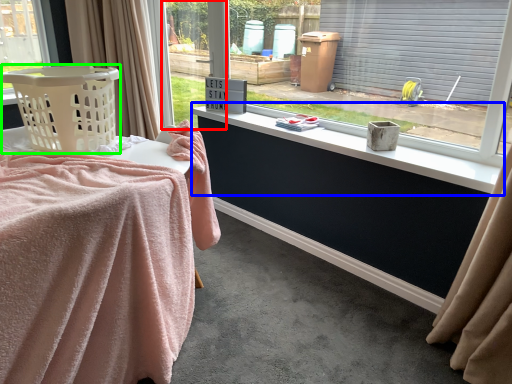
Question: Which object is the farthest from window frame (highlighted by a red box)? Choose among these: window sill (highlighted by a blue box) or basket (highlighted by a green box).

Choices:
 (A) window sill
 (B) basket

Answer: (B)